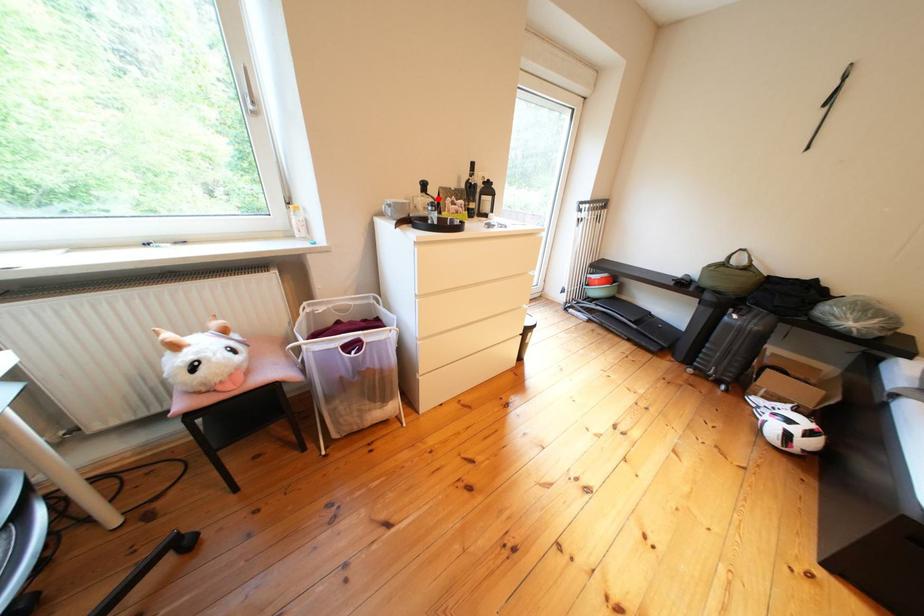
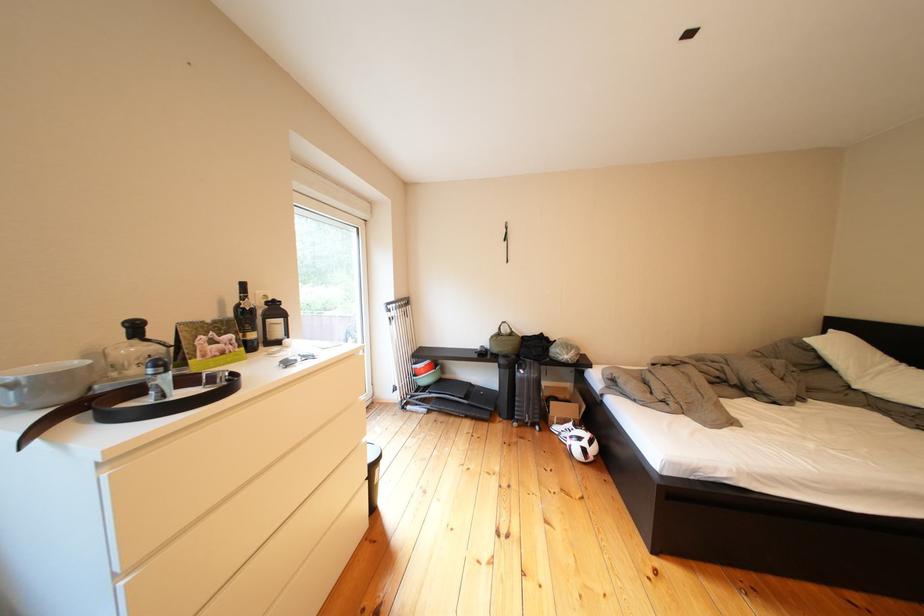
Where in the second image is the point corresponding to the highlighted location from the first image?

(150, 345)